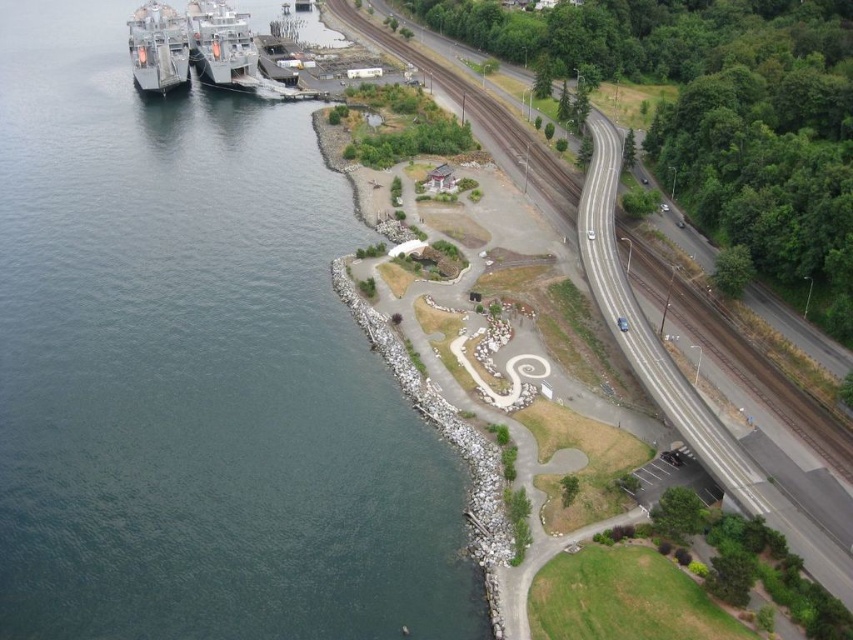
Describe the element at coordinates (195, 371) in the screenshot. I see `dark blue water at left` at that location.

Which is in front, point (97, 572) or point (236, 42)?

Point (97, 572) is in front.

Is point (363, 496) positioned behind point (239, 77)?

No, it is not.

Identify the location of dark blue water at left. Image resolution: width=853 pixels, height=640 pixels. (195, 371).

Is dark blue water at left below metallic gray ship at left?

Correct, dark blue water at left is located below metallic gray ship at left.

This screenshot has width=853, height=640. What do you see at coordinates (195, 371) in the screenshot?
I see `dark blue water at left` at bounding box center [195, 371].

Find the location of a particular element. Image resolution: width=853 pixels, height=640 pixels. dark blue water at left is located at coordinates (195, 371).

In the scene shown: Can you confirm if gray asphalt train track at center is positioned above metallic gray ship at upper left?

Incorrect, gray asphalt train track at center is not positioned above metallic gray ship at upper left.

Between gray asphalt train track at center and metallic gray ship at upper left, which one is positioned higher?

metallic gray ship at upper left

Which is in front, point (532, 179) or point (218, 22)?

Positioned in front is point (532, 179).

Where is `gray asphalt train track at center`? gray asphalt train track at center is located at coordinates (682, 372).